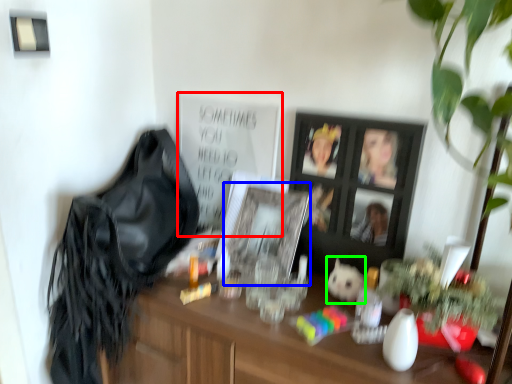
Question: Which object is the farthest from bulletin board (highlighted by a red box)? Choose among these: picture frame (highlighted by a blue box) or animal (highlighted by a green box).

Choices:
 (A) picture frame
 (B) animal

Answer: (B)